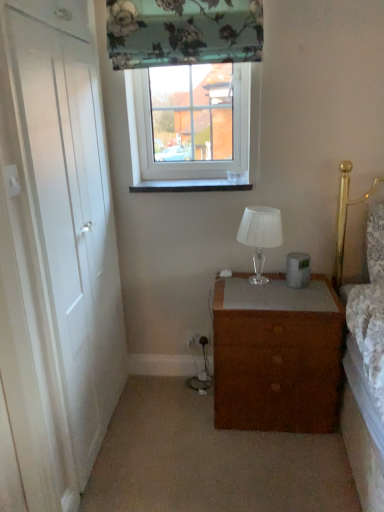
Find the location of a particular element. free space to the left of brown matte chest of drawers at center is located at coordinates (172, 414).